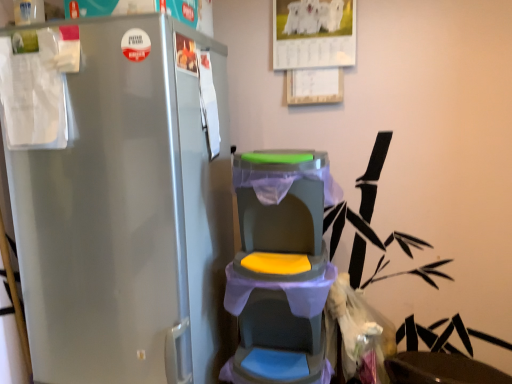
Question: Can you confirm if matte black swivel chair at lower right is taller than matte plastic baby carriage at center?

Choices:
 (A) no
 (B) yes

Answer: (A)

Question: Considering the relative positions of matte black swivel chair at lower right and matte plastic baby carriage at center in the image provided, is matte black swivel chair at lower right to the right of matte plastic baby carriage at center from the viewer's perspective?

Choices:
 (A) yes
 (B) no

Answer: (A)

Question: Is matte black swivel chair at lower right wider than matte plastic baby carriage at center?

Choices:
 (A) yes
 (B) no

Answer: (A)

Question: Is matte black swivel chair at lower right surrounding matte plastic baby carriage at center?

Choices:
 (A) yes
 (B) no

Answer: (B)

Question: Is matte black swivel chair at lower right closer to the viewer compared to matte plastic baby carriage at center?

Choices:
 (A) no
 (B) yes

Answer: (A)

Question: Does matte black swivel chair at lower right have a lesser height compared to matte plastic baby carriage at center?

Choices:
 (A) yes
 (B) no

Answer: (A)

Question: Does matte plastic baby carriage at center have a smaller size compared to matte black swivel chair at lower right?

Choices:
 (A) no
 (B) yes

Answer: (B)

Question: From a real-world perspective, is matte plastic baby carriage at center on top of matte black swivel chair at lower right?

Choices:
 (A) yes
 (B) no

Answer: (A)

Question: Is matte plastic baby carriage at center touching matte black swivel chair at lower right?

Choices:
 (A) no
 (B) yes

Answer: (A)

Question: From a real-world perspective, is matte plastic baby carriage at center positioned under matte black swivel chair at lower right based on gravity?

Choices:
 (A) no
 (B) yes

Answer: (A)

Question: From the image's perspective, is matte plastic baby carriage at center on top of matte black swivel chair at lower right?

Choices:
 (A) yes
 (B) no

Answer: (A)

Question: Can you confirm if matte plastic baby carriage at center is shorter than matte black swivel chair at lower right?

Choices:
 (A) no
 (B) yes

Answer: (A)

Question: Considering the positions of matte plastic baby carriage at center and matte black swivel chair at lower right in the image, is matte plastic baby carriage at center wider or thinner than matte black swivel chair at lower right?

Choices:
 (A) wide
 (B) thin

Answer: (B)